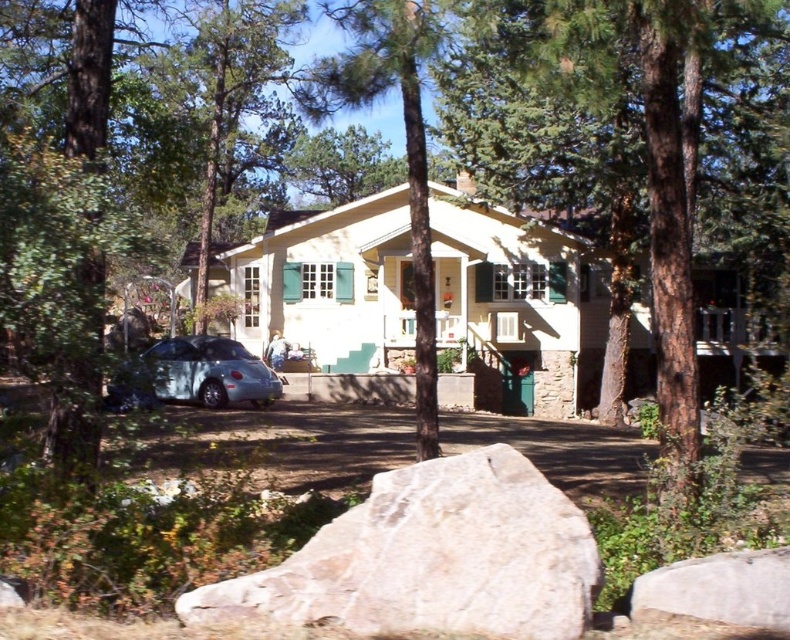
Question: Which object is farther from the camera taking this photo?

Choices:
 (A) gray rough rock at lower right
 (B) green textured tree at center
 (C) white rough rock at lower center

Answer: (B)

Question: Is brown textured tree at center above gray asphalt driveway at center?

Choices:
 (A) no
 (B) yes

Answer: (B)

Question: Among these objects, which one is nearest to the camera?

Choices:
 (A) satin silver car at left
 (B) brown textured tree at center
 (C) gray rough rock at lower right

Answer: (C)

Question: Which of these objects is positioned farthest from the gray rough rock at lower right?

Choices:
 (A) yellow matte house at center
 (B) white rough rock at lower center

Answer: (A)

Question: Can you confirm if gray rough rock at lower right is wider than satin silver car at left?

Choices:
 (A) yes
 (B) no

Answer: (B)

Question: Is yellow matte house at center to the left of gray asphalt driveway at center from the viewer's perspective?

Choices:
 (A) yes
 (B) no

Answer: (A)